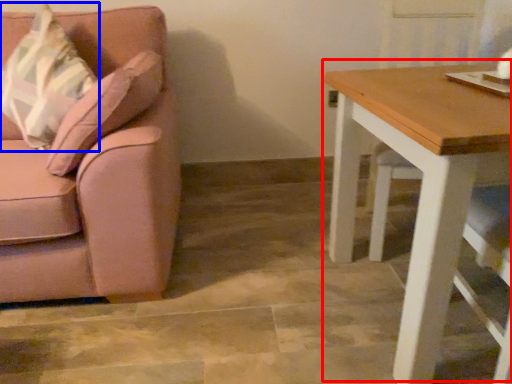
Question: Which point is closer to the camera, table (highlighted by a red box) or throw pillow (highlighted by a blue box)?

Choices:
 (A) table
 (B) throw pillow

Answer: (A)